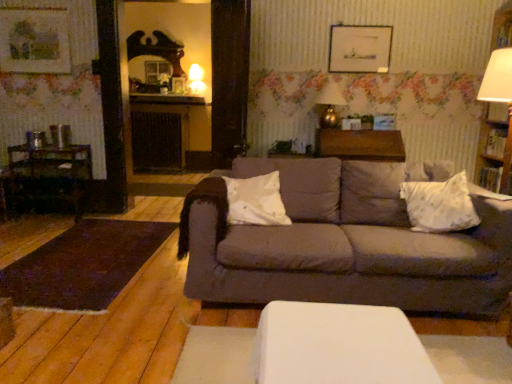
At what (x,y) coordinates should I click in order to perform the action: click on vacant space situated above wooden picture frame at upper left, the 2th picture frame positioned from the right (from a real-world perspective). Please return your answer as a coordinate pair (x, y). Looking at the image, I should click on (29, 8).